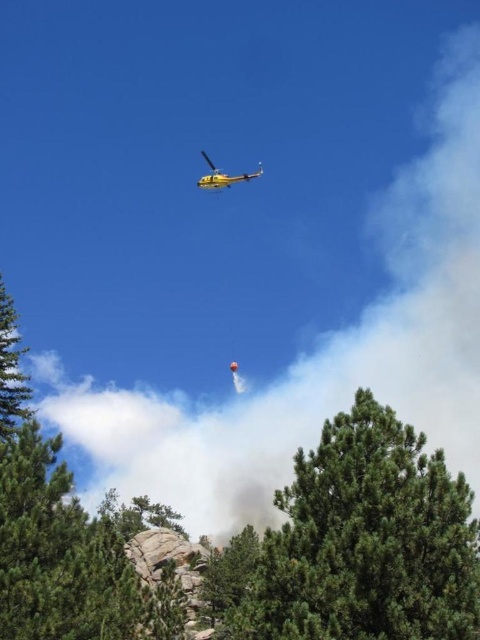
You are a firefighter pilot flying a yellow helicopter in the upper portion of the frame. You need to drop a red cylindrical container suspended below you onto the green textured tree at center. What coordinates should you aim for?

The green textured tree at center is located at coordinates point (359,541), so you should aim for that point to drop the red cylindrical container onto it.

You are a firefighter trying to land a helicopter in a forest area. The helicopter needs a clear space of at least 10 meters between trees to land safely. Based on the scene, can you determine if the green textured tree at center and the green matte tree at center are spaced far enough apart for a safe landing?

The green textured tree at center is 8.08 meters away from the green matte tree at center. Since the required distance for safe landing is 10 meters, the trees are too close together for a safe landing.